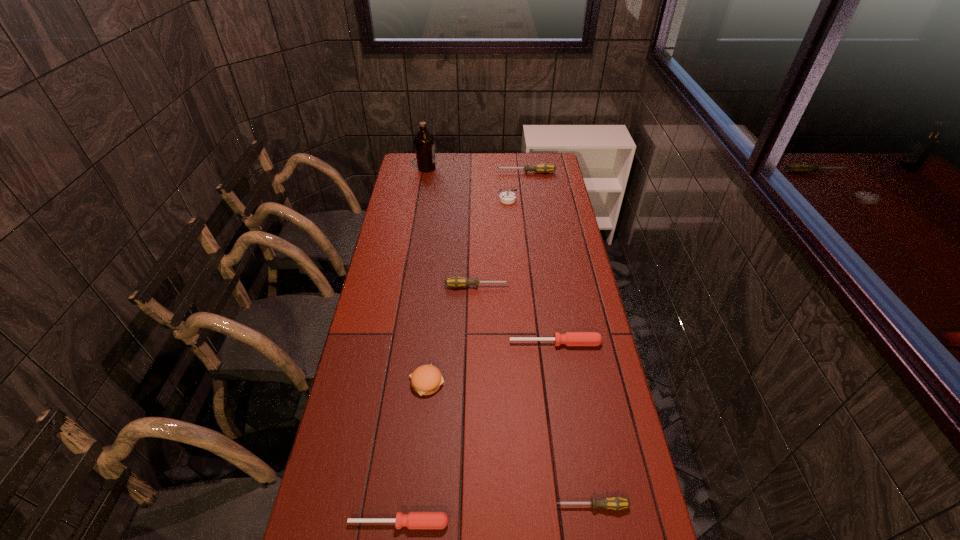
Locate an element on the screen. Image resolution: width=960 pixels, height=540 pixels. the nearest screwdriver is located at coordinates (414, 520).

The width and height of the screenshot is (960, 540). I want to click on the left red screwdriver, so click(414, 520).

What are the coordinates of `the smallest gray screwdriver` in the screenshot? It's located at (616, 503).

This screenshot has height=540, width=960. In order to click on the second nearest object in this screenshot , I will do `click(616, 503)`.

Locate an element on the screen. vacant area located 0.300m on the label of the brown olive oil is located at coordinates (496, 168).

Where is `free space located on the left of the third farthest object`? This screenshot has height=540, width=960. free space located on the left of the third farthest object is located at coordinates (421, 199).

The width and height of the screenshot is (960, 540). I want to click on vacant region located 0.400m at the tip of the tallest screwdriver, so click(x=416, y=173).

You are a GUI agent. You are given a task and a screenshot of the screen. Output one action in this format:
    pyautogui.click(x=<x>, y=<y>)
    Task: Click on the vacant space located at the tip of the tallest screwdriver
    This screenshot has height=540, width=960.
    Given the screenshot: What is the action you would take?
    point(466,173)

This screenshot has height=540, width=960. In order to click on free space located 0.110m at the tip of the tallest screwdriver in this screenshot , I will do `click(473, 173)`.

Identify the location of free space located 0.340m on the front of the third nearest object. (413, 524).